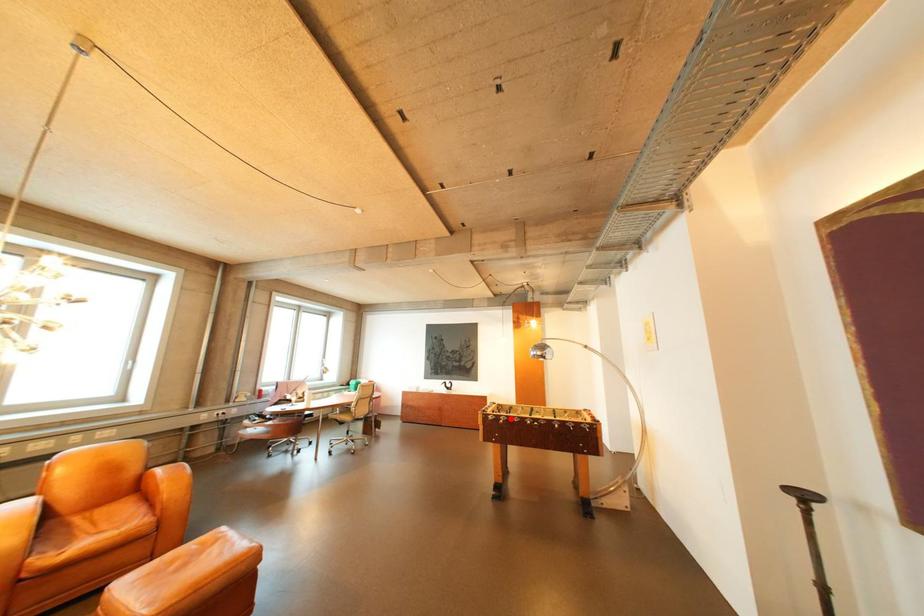
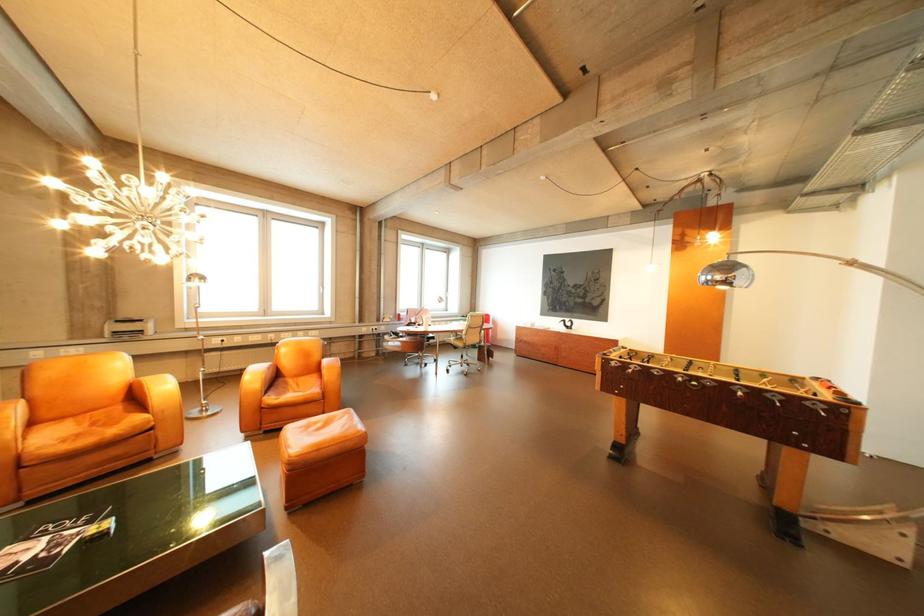
Find the pixel in the second image that matches the highlighted location in the first image.

(638, 367)